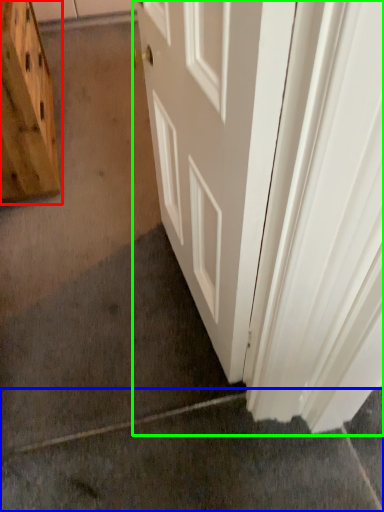
Question: Estimate the real-world distances between objects in this image. Which object is farther from cabinetry (highlighted by a red box), concrete (highlighted by a blue box) or door (highlighted by a green box)?

Choices:
 (A) concrete
 (B) door

Answer: (A)